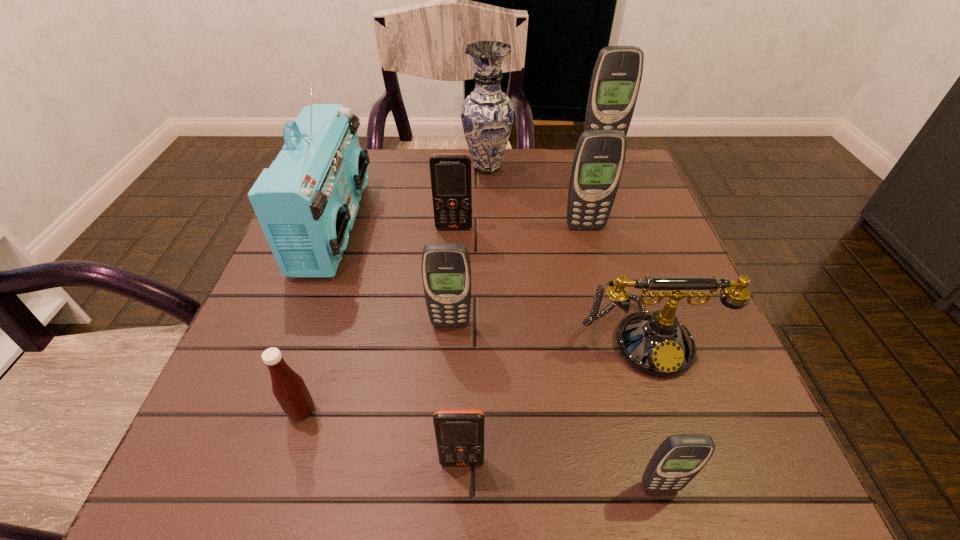
In order to click on white Tabasco sauce in this screenshot , I will do `click(288, 387)`.

I want to click on the eighth farthest object, so click(x=288, y=387).

I want to click on the fifth farthest cellular telephone, so click(x=459, y=433).

Image resolution: width=960 pixels, height=540 pixels. In order to click on the second nearest object in this screenshot , I will do `click(459, 433)`.

Find the location of `the nearest gray cellular telephone`. the nearest gray cellular telephone is located at coordinates (679, 458).

Where is `the smallest gray cellular telephone`? the smallest gray cellular telephone is located at coordinates (679, 458).

Identify the location of free space located 0.160m on the right of the blue vase. The image size is (960, 540). [x=573, y=167].

Identify the location of free space located 0.200m on the front-facing side of the radio receiver. (453, 226).

Locate an element on the screen. vacant space located on the screen of the biggest gray cellular telephone is located at coordinates point(632,235).

Identify the location of free location located on the screen of the fourth tallest object. This screenshot has width=960, height=540. pyautogui.click(x=599, y=280).